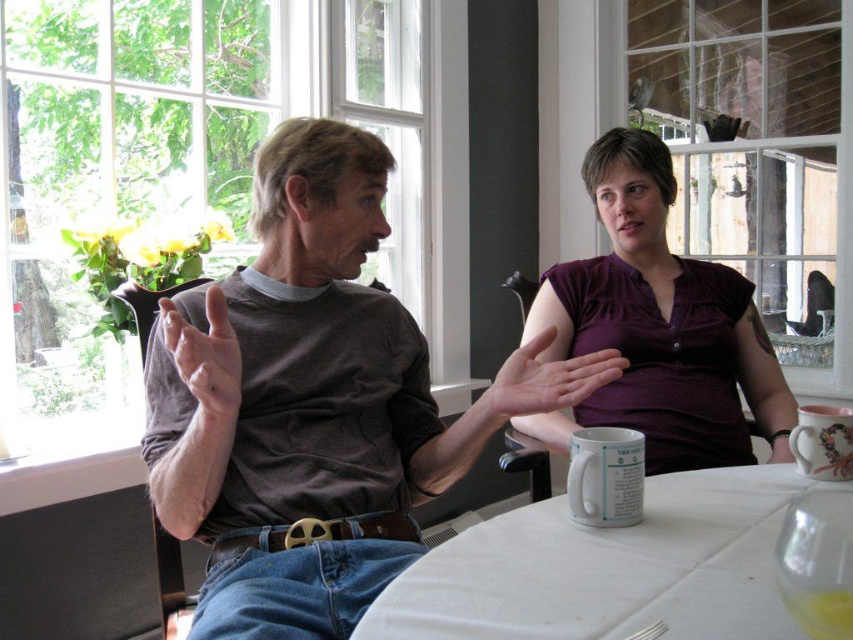
Question: Which object is closer to the camera taking this photo?

Choices:
 (A) white fabric table at center
 (B) brown cotton shirt at left

Answer: (A)

Question: Among these points, which one is farthest from the camera?

Choices:
 (A) (776, 534)
 (B) (544, 314)

Answer: (B)

Question: Can you confirm if brown cotton shirt at left is thinner than purple cotton shirt at upper right?

Choices:
 (A) no
 (B) yes

Answer: (A)

Question: Among these points, which one is farthest from the camera?

Choices:
 (A) (538, 628)
 (B) (589, 403)
 (C) (397, 412)

Answer: (B)

Question: Does white fabric table at center have a smaller size compared to purple cotton shirt at upper right?

Choices:
 (A) yes
 (B) no

Answer: (A)

Question: Is brown cotton shirt at left positioned at the back of purple cotton shirt at upper right?

Choices:
 (A) yes
 (B) no

Answer: (B)